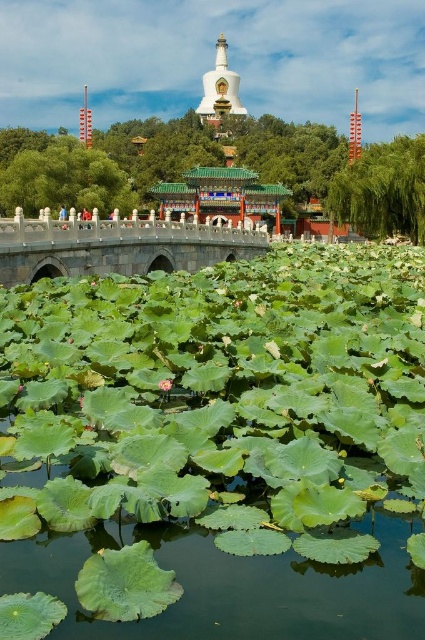
Who is shorter, green leafy water at center or stone bridge at center?

green leafy water at center

Is green leafy water at center to the left of stone bridge at center from the viewer's perspective?

In fact, green leafy water at center is to the right of stone bridge at center.

Describe the element at coordinates (235, 586) in the screenshot. This screenshot has height=640, width=425. I see `green leafy water at center` at that location.

Where is `green leafy water at center`? green leafy water at center is located at coordinates (235, 586).